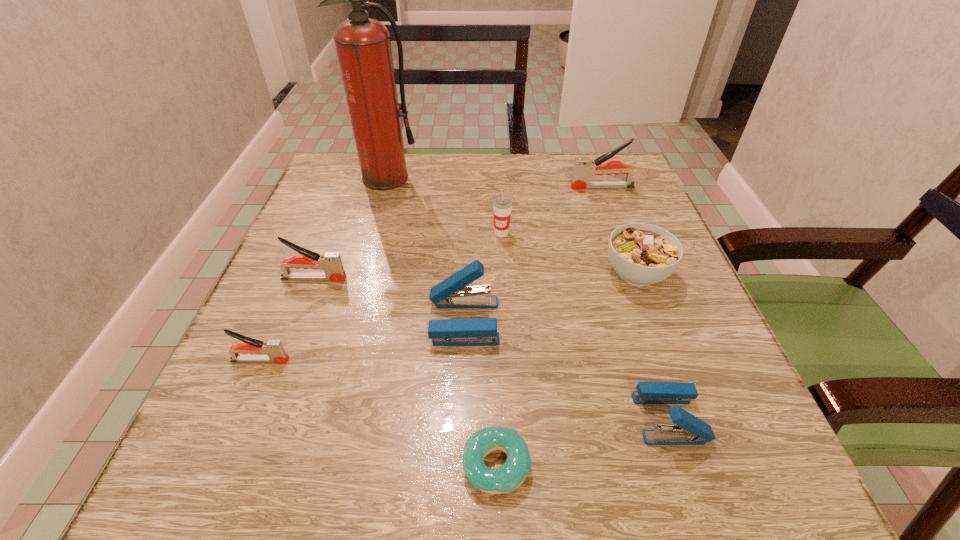
This screenshot has height=540, width=960. Find the location of `fire extinguisher`. fire extinguisher is located at coordinates (363, 45).

Identify the location of the tallest object. (363, 45).

Where is `the rightmost gray stapler`? Image resolution: width=960 pixels, height=540 pixels. the rightmost gray stapler is located at coordinates (584, 168).

Where is `the farthest stapler`? The width and height of the screenshot is (960, 540). the farthest stapler is located at coordinates (584, 168).

In order to click on cup in this screenshot , I will do `click(502, 205)`.

Identify the location of red cup. Image resolution: width=960 pixels, height=540 pixels. (502, 205).

The width and height of the screenshot is (960, 540). I want to click on the fourth nearest stapler, so click(330, 262).

The image size is (960, 540). Find the location of `the second farthest gray stapler`. the second farthest gray stapler is located at coordinates (330, 262).

Identify the location of the third stapler from right to left. The image size is (960, 540). (450, 293).

Locate an element on the screen. This screenshot has width=960, height=540. the third nearest stapler is located at coordinates (450, 293).